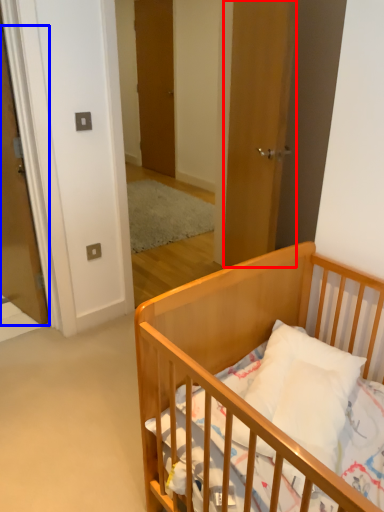
Question: Among these objects, which one is nearest to the camera, door (highlighted by a red box) or door (highlighted by a blue box)?

Choices:
 (A) door
 (B) door

Answer: (A)